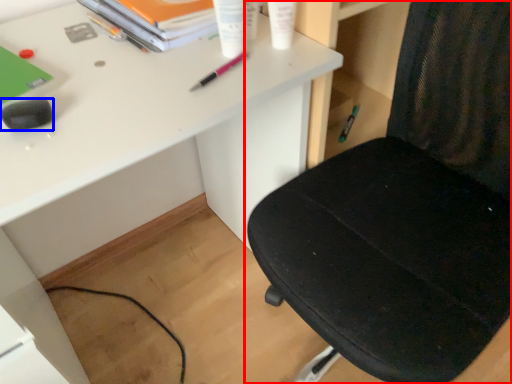
Question: Which of the following is the closest to the observer, chair (highlighted by a red box) or stationery (highlighted by a blue box)?

Choices:
 (A) chair
 (B) stationery

Answer: (A)